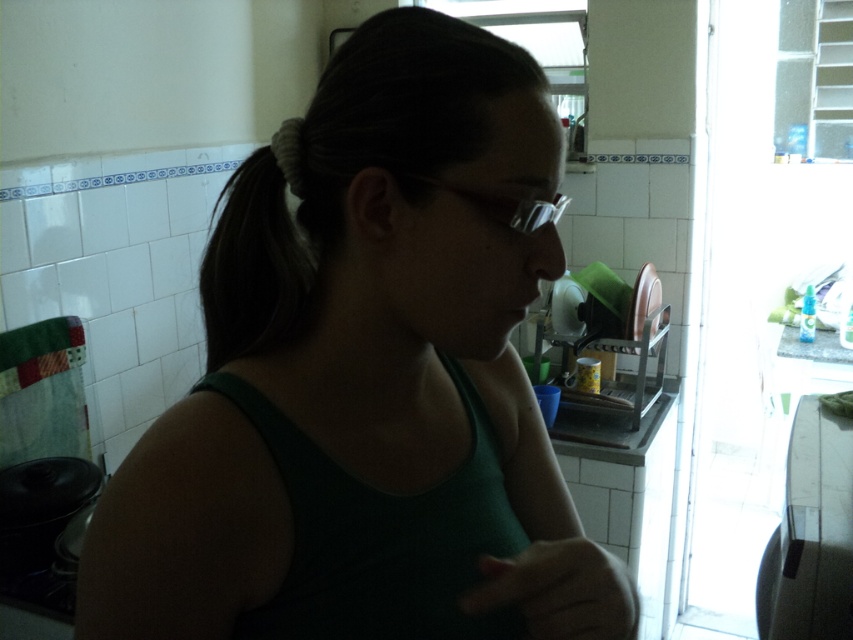
You are a fashion designer observing the image. You need to determine the order of the green matte tank top at center and the dark brown hair at center from the viewer. Which one is closer to you?

The green matte tank top at center is closer to you because it is in front of the dark brown hair at center.

You are a chef in a busy kitchen. You need to grab the transparent plastic glasses at center without touching the green fabric hand at lower center. How can you do this?

The green fabric hand at lower center is positioned under the transparent plastic glasses at center. To grab the glasses without touching the hand, carefully lift the glasses upward and away from the hand.

You are a fashion designer observing a model wearing a green matte tank top at center and with dark brown hair at center. Which item is bigger in size?

The green matte tank top at center is larger in size than the dark brown hair at center.